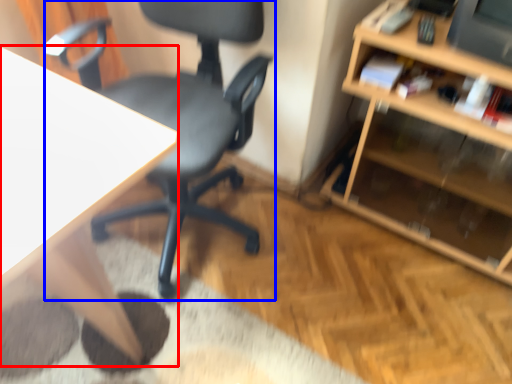
Question: Among these objects, which one is farthest to the camera, desk (highlighted by a red box) or chair (highlighted by a blue box)?

Choices:
 (A) desk
 (B) chair

Answer: (B)